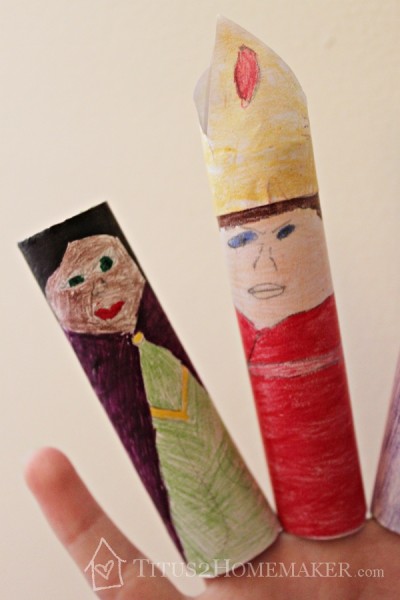
Image resolution: width=400 pixels, height=600 pixels. In order to click on wall in this screenshot , I will do `click(175, 172)`.